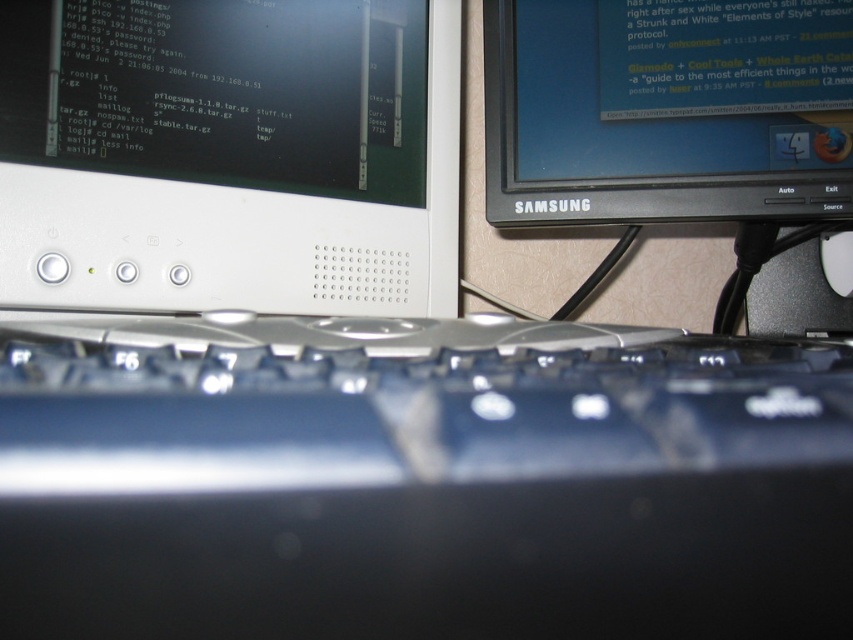
You are setting up a new desk and have to place the black plastic keyboard at center and the black glossy monitor at upper right. According to the image, which object should be placed closer to you to replicate the setup?

The black plastic keyboard at center should be placed closer to you because it is in front of the black glossy monitor at upper right in the image.

You are a technician who needs to clean the white plastic monitor at upper center. Your cleaning tool can only reach up to 24 inches. Can you reach it?

The white plastic monitor at upper center is 24.45 inches away from the viewer, which is slightly beyond the 24 inches reach of the cleaning tool. Therefore, you cannot reach it with the current tool.

You need to place a new wireless charger that is 15 cm in width. You have space between the white plastic monitor at upper center and the white plastic mouse at center. Can the charger fit horizontally in that space?

The white plastic monitor at upper center might be wider than the white plastic mouse at center, so the space between them may not be sufficient to fit a 15 cm wide wireless charger. Check the exact dimensions before placing it.